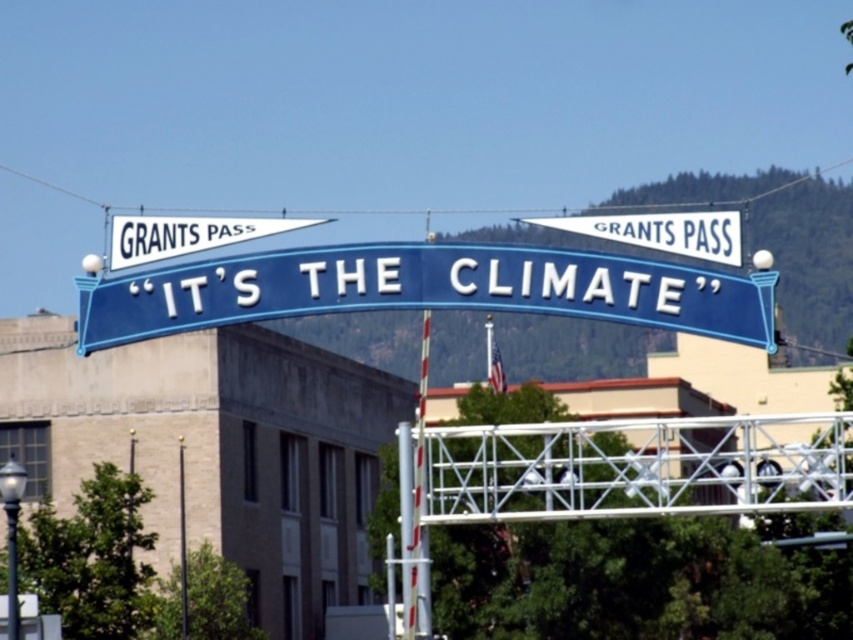
Is white fabric pennant at upper center taller than metallic silver pole at center?

In fact, white fabric pennant at upper center may be shorter than metallic silver pole at center.

Consider the image. Does white fabric pennant at upper center appear on the left side of metallic silver pole at center?

Correct, you'll find white fabric pennant at upper center to the left of metallic silver pole at center.

The width and height of the screenshot is (853, 640). Describe the element at coordinates (187, 234) in the screenshot. I see `white fabric pennant at upper center` at that location.

Locate an element on the screen. This screenshot has height=640, width=853. white fabric pennant at upper center is located at coordinates (187, 234).

Who is higher up, blue metallic sign at center or white fabric pennant at upper center?

white fabric pennant at upper center is above.

What do you see at coordinates (425, 289) in the screenshot?
I see `blue metallic sign at center` at bounding box center [425, 289].

Based on the photo, who is more distant from viewer, (415,296) or (142,224)?

The point (142,224) is behind.

The image size is (853, 640). I want to click on blue metallic sign at center, so click(425, 289).

Is blue metallic sign at center taller than smooth metal pole at center?

No.

Which is in front, point (482, 269) or point (184, 556)?

Point (482, 269)

Find the location of `blue metallic sign at center`. blue metallic sign at center is located at coordinates (425, 289).